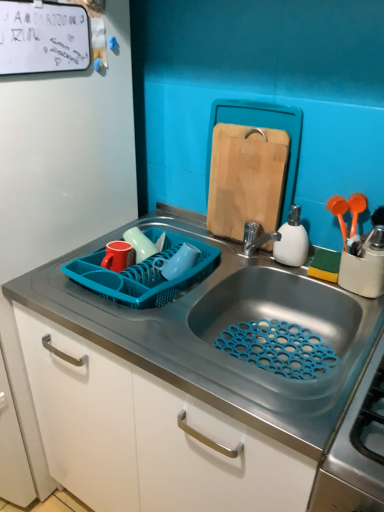
Question: Can you confirm if blue plastic dish rack at left is wider than wooden cutting board at upper center?

Choices:
 (A) no
 (B) yes

Answer: (B)

Question: Does blue plastic dish rack at left have a smaller size compared to wooden cutting board at upper center?

Choices:
 (A) yes
 (B) no

Answer: (B)

Question: Does blue plastic dish rack at left have a lesser width compared to wooden cutting board at upper center?

Choices:
 (A) no
 (B) yes

Answer: (A)

Question: Is blue plastic dish rack at left not inside wooden cutting board at upper center?

Choices:
 (A) no
 (B) yes

Answer: (B)

Question: Does blue plastic dish rack at left turn towards wooden cutting board at upper center?

Choices:
 (A) no
 (B) yes

Answer: (A)

Question: Would you say wooden cutting board at upper center is inside or outside white matte dry erase board at upper left?

Choices:
 (A) inside
 (B) outside

Answer: (B)

Question: Is wooden cutting board at upper center taller or shorter than white matte dry erase board at upper left?

Choices:
 (A) short
 (B) tall

Answer: (B)

Question: From a real-world perspective, is wooden cutting board at upper center above or below white matte dry erase board at upper left?

Choices:
 (A) below
 (B) above

Answer: (A)

Question: Considering the positions of wooden cutting board at upper center and white matte dry erase board at upper left in the image, is wooden cutting board at upper center wider or thinner than white matte dry erase board at upper left?

Choices:
 (A) wide
 (B) thin

Answer: (A)

Question: Would you say metallic sink at center is to the left or to the right of white matte dry erase board at upper left in the picture?

Choices:
 (A) left
 (B) right

Answer: (B)

Question: From a real-world perspective, relative to white matte dry erase board at upper left, is metallic sink at center vertically above or below?

Choices:
 (A) below
 (B) above

Answer: (A)

Question: Which is correct: metallic sink at center is inside white matte dry erase board at upper left, or outside of it?

Choices:
 (A) inside
 (B) outside

Answer: (B)

Question: Considering the positions of metallic sink at center and white matte dry erase board at upper left in the image, is metallic sink at center bigger or smaller than white matte dry erase board at upper left?

Choices:
 (A) big
 (B) small

Answer: (A)

Question: Would you say teal plastic basket at sink is to the left or to the right of wooden cutting board at upper center in the picture?

Choices:
 (A) left
 (B) right

Answer: (A)

Question: From the image's perspective, is teal plastic basket at sink positioned above or below wooden cutting board at upper center?

Choices:
 (A) below
 (B) above

Answer: (A)